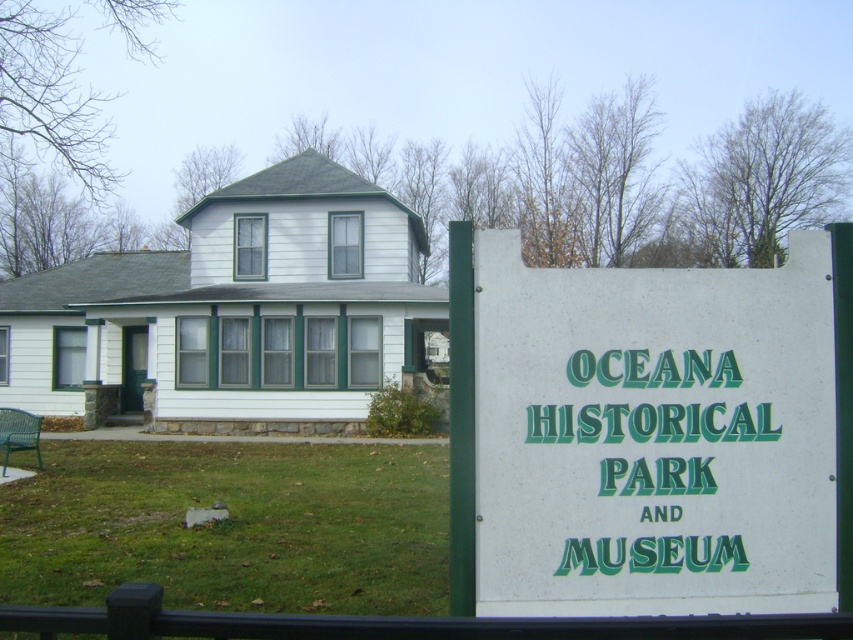
Question: Where is white plastic sign at center located in relation to green grass at lower center in the image?

Choices:
 (A) left
 (B) right

Answer: (B)

Question: Which of the following is the farthest from the observer?

Choices:
 (A) (364, 557)
 (B) (642, 460)

Answer: (A)

Question: Does white plastic sign at center appear over green grass at lower center?

Choices:
 (A) yes
 (B) no

Answer: (A)

Question: Which point appears closest to the camera in this image?

Choices:
 (A) (819, 273)
 (B) (187, 536)

Answer: (A)

Question: Does white plastic sign at center appear under green grass at lower center?

Choices:
 (A) no
 (B) yes

Answer: (A)

Question: Which of the following is the closest to the observer?

Choices:
 (A) green grass at lower center
 (B) white plastic sign at center

Answer: (A)